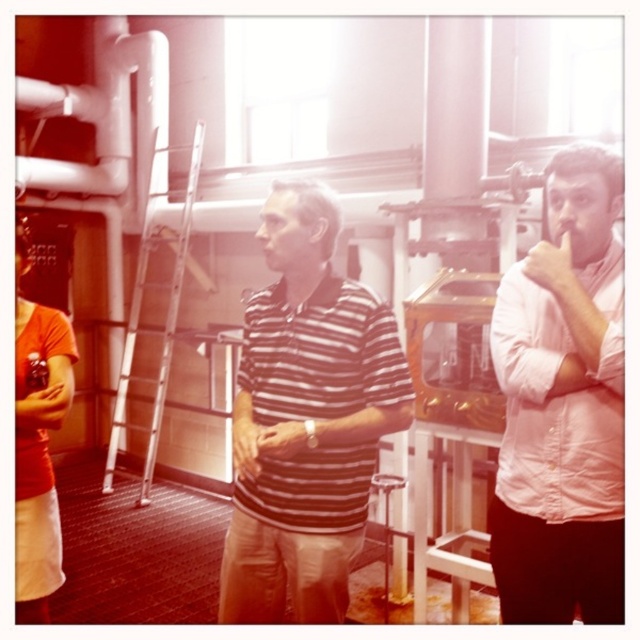
Can you confirm if striped cotton shirt at center is positioned above metallic silver ladder at center?

No, striped cotton shirt at center is not above metallic silver ladder at center.

Who is positioned more to the right, striped cotton shirt at center or metallic silver ladder at center?

striped cotton shirt at center is more to the right.

Between point (324, 612) and point (122, 406), which one is positioned behind?

Positioned behind is point (122, 406).

The image size is (640, 640). I want to click on striped cotton shirt at center, so click(x=307, y=419).

Who is taller, striped cotton shirt at center or pink cotton shirt at center?

Standing taller between the two is pink cotton shirt at center.

What do you see at coordinates (307, 419) in the screenshot? I see `striped cotton shirt at center` at bounding box center [307, 419].

The height and width of the screenshot is (640, 640). What are the coordinates of `striped cotton shirt at center` in the screenshot? It's located at (307, 419).

Does pink cotton shirt at center appear over metallic silver ladder at center?

No, pink cotton shirt at center is not above metallic silver ladder at center.

Is pink cotton shirt at center thinner than metallic silver ladder at center?

Yes, pink cotton shirt at center is thinner than metallic silver ladder at center.

Find the location of `pink cotton shirt at center`. pink cotton shirt at center is located at coordinates (563, 404).

At what (x,y) coordinates should I click in order to perform the action: click on pink cotton shirt at center. Please return your answer as a coordinate pair (x, y). This screenshot has height=640, width=640. Looking at the image, I should click on (563, 404).